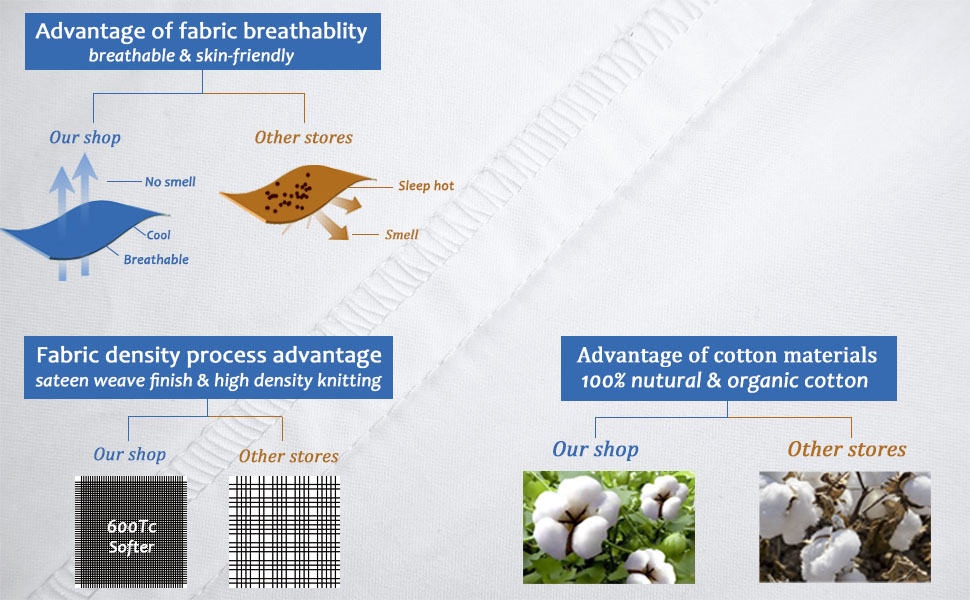
Find the location of a particular element. Image resolution: width=970 pixels, height=600 pixels. fabric is located at coordinates (825, 236).